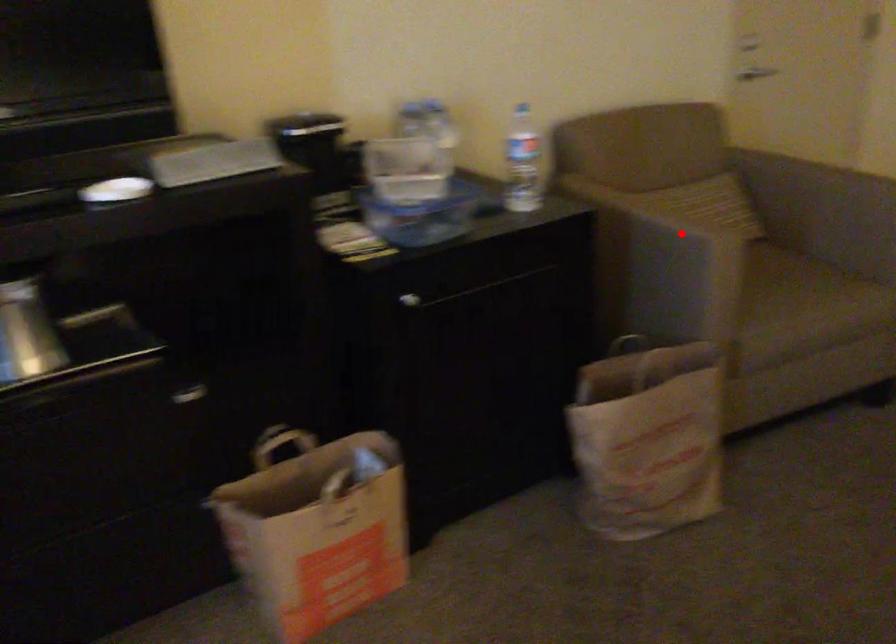
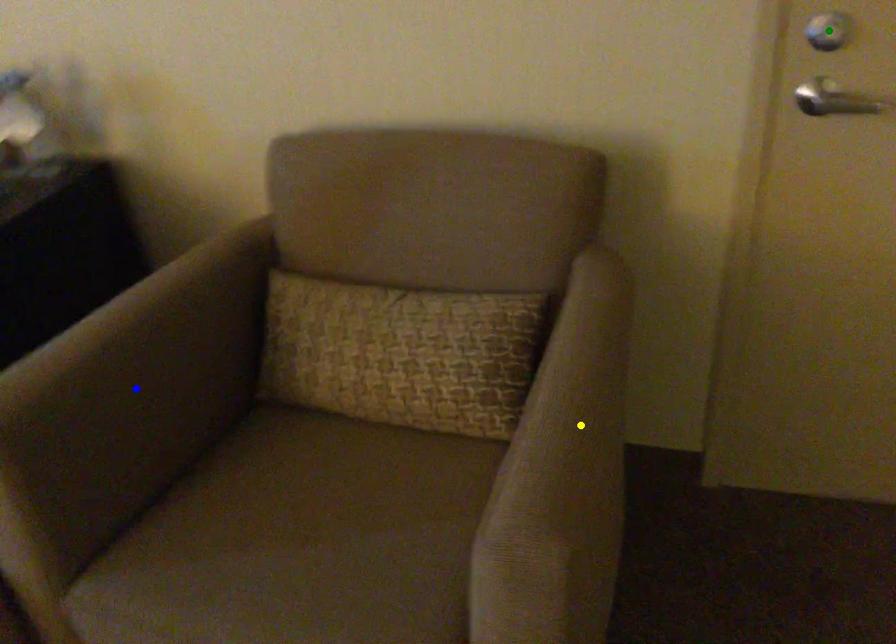
Question: I am providing you with two images of the same scene from different viewpoints. A red point is marked on the first image. You are given multiple points on the second image. Which mark in image 2 goes with the point in image 1?

Choices:
 (A) green point
 (B) blue point
 (C) yellow point

Answer: (B)